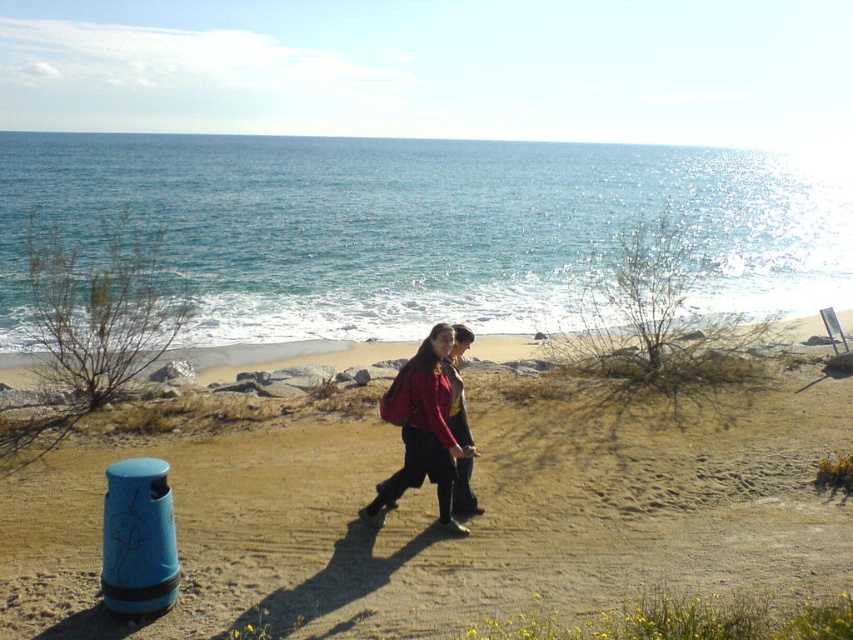
Is brown sandy beach at center behind blue water at upper center?

No, brown sandy beach at center is closer to the viewer.

Which is behind, point (508, 522) or point (402, 152)?

Positioned behind is point (402, 152).

Locate an element on the screen. brown sandy beach at center is located at coordinates (469, 524).

This screenshot has width=853, height=640. What are the coordinates of `blue water at upper center` in the screenshot? It's located at 425,227.

Is point (216, 275) positioned behind point (434, 483)?

Yes, it is behind point (434, 483).

Find the location of a particular element. The image size is (853, 640). blue water at upper center is located at coordinates (425, 227).

Does point (413, 634) come closer to viewer compared to point (444, 355)?

Yes, it is in front of point (444, 355).

Is brown sandy beach at center thinner than matte red jacket at center?

No.

This screenshot has height=640, width=853. What are the coordinates of `brown sandy beach at center` in the screenshot? It's located at (469, 524).